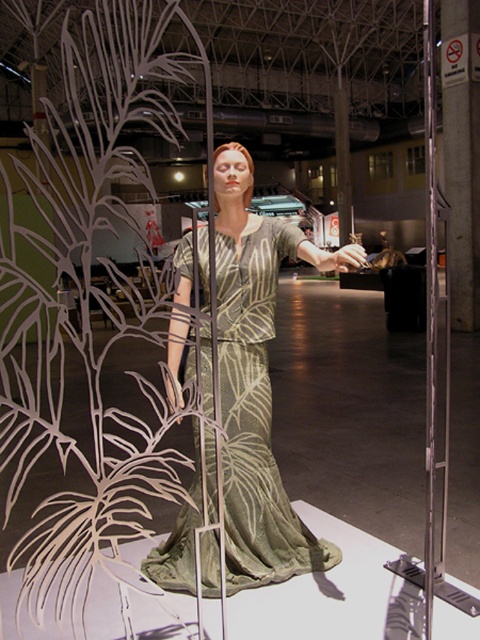
You are a store manager who needs to move the silvery metallic dress at center closer to the green leafy plant at center for a new display. The store has a 5 meter long aisle between them. Can you move the dress to within 3 meters of the plant without moving the plant?

The current distance between the green leafy plant at center and the silvery metallic dress at center is 4.65 meters. Since the aisle is 5 meters long, moving the dress closer by 1.65 meters would reduce the distance to 3 meters. This is feasible within the available space, so yes, the dress can be moved to within 3 meters of the plant.

You are a window dresser arranging a display. You have a green leafy plant at center and a silvery metallic dress at center. Which object is taller?

The green leafy plant at center is taller than the silvery metallic dress at center.